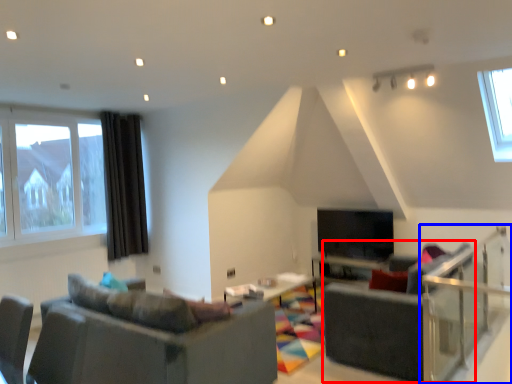
Question: Which point is further to the camera, armchair (highlighted by a red box) or balustrade (highlighted by a blue box)?

Choices:
 (A) armchair
 (B) balustrade

Answer: (A)